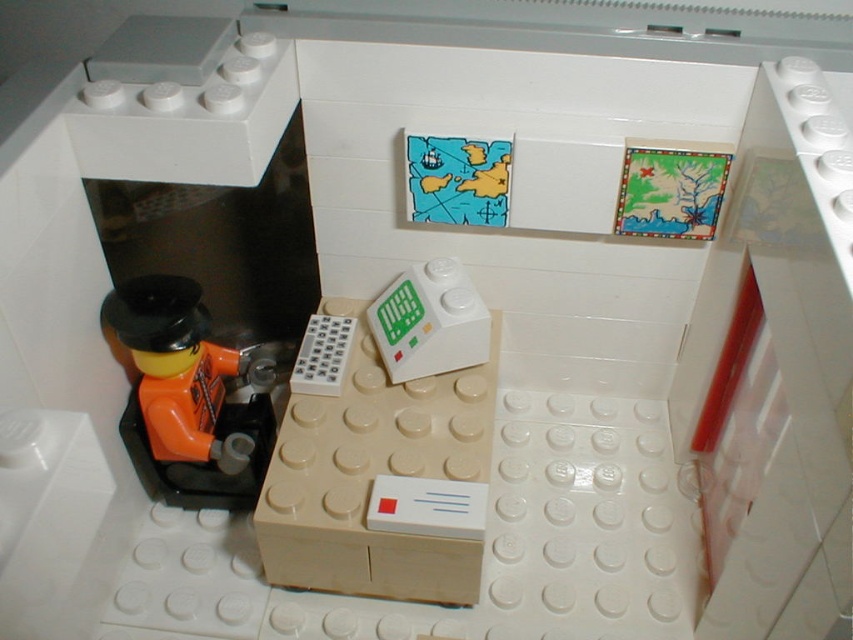
Does beige plastic drawer at center have a lesser height compared to orange matte figure at left?

No.

Measure the distance between beige plastic drawer at center and orange matte figure at left.

7.97 inches

Which is in front, point (277, 538) or point (171, 307)?

Point (277, 538) is more forward.

Where is `beige plastic drawer at center`? This screenshot has width=853, height=640. beige plastic drawer at center is located at coordinates (389, 452).

Who is more distant from viewer, (160,492) or (314,330)?

The point (314,330) is behind.

Is point (256, 472) closer to camera compared to point (305, 365)?

That is True.

Find the location of a particular element. The image size is (853, 640). orange matte figure at left is located at coordinates (189, 396).

Between beige plastic drawer at center and white plastic remote at lower left, which one is positioned higher?

Positioned higher is white plastic remote at lower left.

Does beige plastic drawer at center have a larger size compared to white plastic remote at lower left?

Yes.

Does point (421, 376) come farther from viewer compared to point (323, 394)?

That is True.

Find the location of a particular element. beige plastic drawer at center is located at coordinates (389, 452).